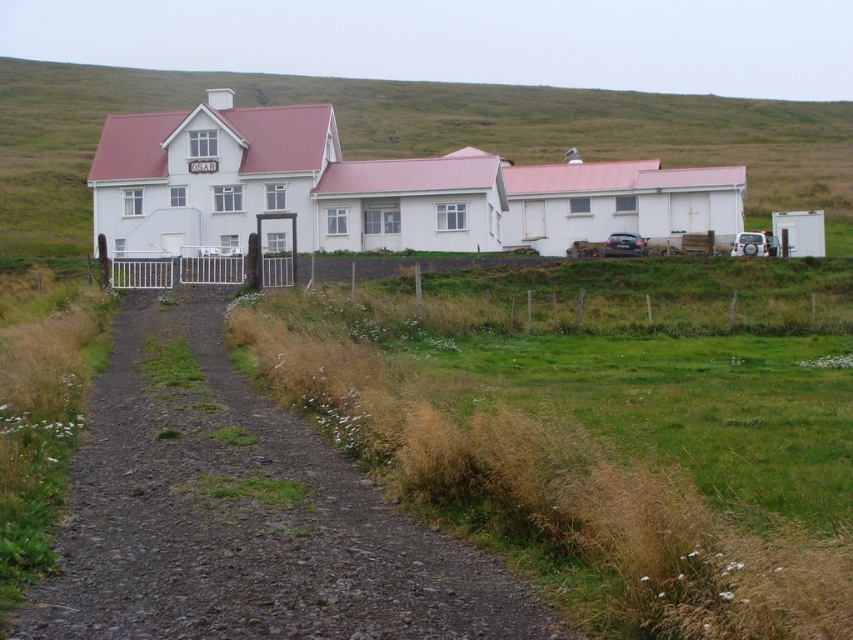
You are standing at the gravel path leading to the gate. You see the green grassy at lower left and the silver metallic suv at right. Which object is closer to the entrance gate?

The green grassy at lower left is located below the silver metallic suv at right, so the green grassy at lower left is closer to the entrance gate.